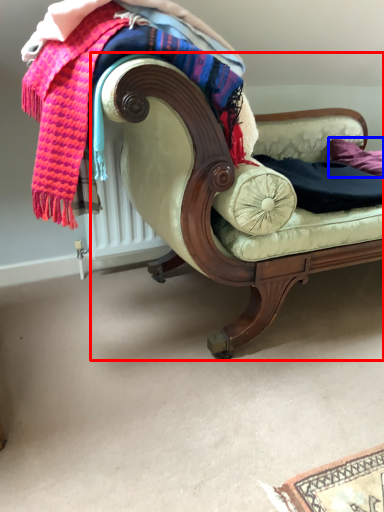
Question: Among these objects, which one is farthest to the camera, studio couch (highlighted by a red box) or pillow (highlighted by a blue box)?

Choices:
 (A) studio couch
 (B) pillow

Answer: (B)